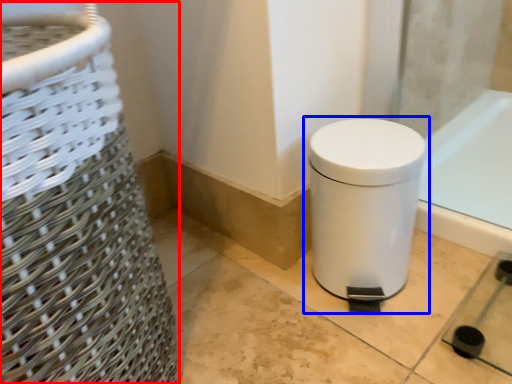
Question: Which point is closer to the camera, basket container (highlighted by a red box) or waste container (highlighted by a blue box)?

Choices:
 (A) basket container
 (B) waste container

Answer: (A)